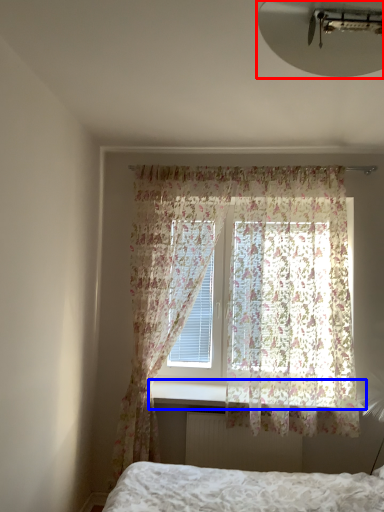
Question: Which point is closer to the camera, light fixture (highlighted by a red box) or window sill (highlighted by a blue box)?

Choices:
 (A) light fixture
 (B) window sill

Answer: (A)